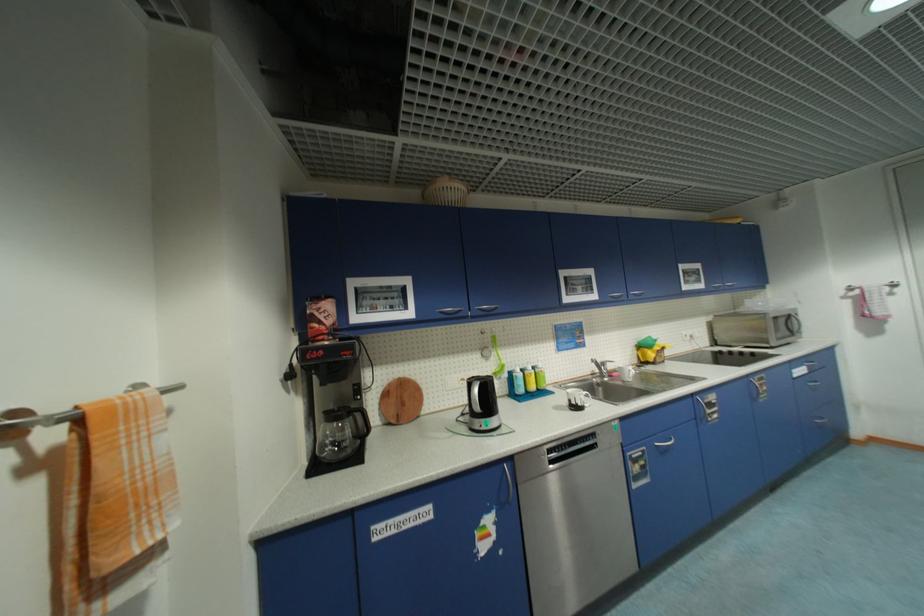
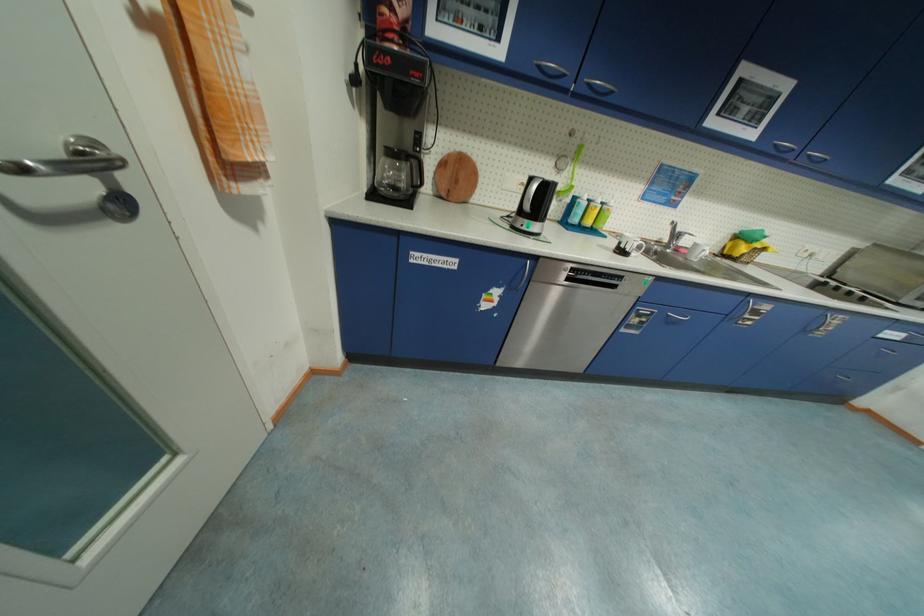
Where in the second image is the point corresponding to pixel 485 310 from the first image?

(594, 86)